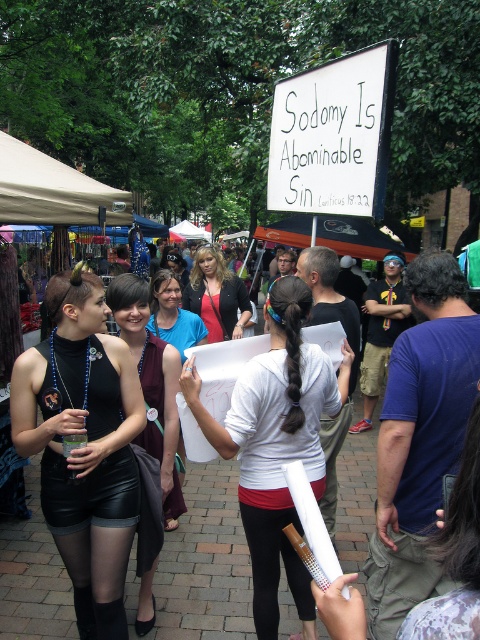
Question: Estimate the real-world distances between objects in this image. Which object is closer to the matte black shorts at lower left?

Choices:
 (A) white matte paper at center
 (B) leather skirt at left
 (C) matte black jacket at center

Answer: (B)

Question: Is matte black shorts at lower left in front of leather skirt at left?

Choices:
 (A) yes
 (B) no

Answer: (B)

Question: Estimate the real-world distances between objects in this image. Which object is farther from the leather skirt at center?

Choices:
 (A) leather skirt at left
 (B) matte black shorts at lower left
 (C) white matte paper at center

Answer: (B)

Question: Does leather skirt at center appear over leather skirt at left?

Choices:
 (A) no
 (B) yes

Answer: (B)

Question: Which of the following is the closest to the observer?

Choices:
 (A) leather skirt at left
 (B) matte black jacket at center

Answer: (A)

Question: Is matte black shorts at lower left wider than leather skirt at left?

Choices:
 (A) no
 (B) yes

Answer: (B)